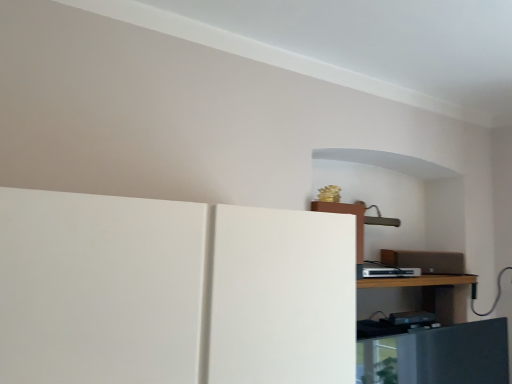
Question: In terms of size, does brown wooden shelf at center appear bigger or smaller than silver metallic cable box at upper right?

Choices:
 (A) small
 (B) big

Answer: (B)

Question: From their relative heights in the image, would you say brown wooden shelf at center is taller or shorter than silver metallic cable box at upper right?

Choices:
 (A) short
 (B) tall

Answer: (A)

Question: Is brown wooden shelf at center in front of or behind silver metallic cable box at upper right in the image?

Choices:
 (A) front
 (B) behind

Answer: (A)

Question: Does point (367, 274) appear closer or farther from the camera than point (451, 274)?

Choices:
 (A) farther
 (B) closer

Answer: (B)

Question: Is silver metallic cable box at upper right spatially inside brown wooden shelf at center, or outside of it?

Choices:
 (A) outside
 (B) inside

Answer: (A)

Question: From their relative heights in the image, would you say silver metallic cable box at upper right is taller or shorter than brown wooden shelf at center?

Choices:
 (A) short
 (B) tall

Answer: (B)

Question: From the image's perspective, is silver metallic cable box at upper right above or below brown wooden shelf at center?

Choices:
 (A) above
 (B) below

Answer: (A)